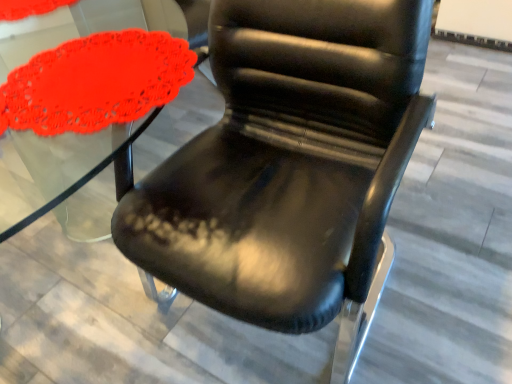
Describe the element at coordinates (290, 166) in the screenshot. The image size is (512, 384). I see `black leather chair at center` at that location.

Locate an element on the screen. black leather chair at center is located at coordinates (290, 166).

Image resolution: width=512 pixels, height=384 pixels. Describe the element at coordinates (83, 104) in the screenshot. I see `matte red doily at left` at that location.

The width and height of the screenshot is (512, 384). Identify the location of matte red doily at left. (83, 104).

The image size is (512, 384). What are the coordinates of `black leather chair at center` in the screenshot? It's located at (290, 166).

Is matte red doily at left at the left side of black leather chair at center?

Yes, matte red doily at left is to the left of black leather chair at center.

Considering the relative positions of matte red doily at left and black leather chair at center in the image provided, is matte red doily at left behind black leather chair at center?

Yes, matte red doily at left is further from the viewer.

Which is in front, point (75, 126) or point (375, 149)?

The point (75, 126) is in front.

From the image's perspective, which is below, matte red doily at left or black leather chair at center?

black leather chair at center appears lower in the image.

From a real-world perspective, is matte red doily at left over black leather chair at center?

Correct, in the physical world, matte red doily at left is higher than black leather chair at center.

Can you confirm if matte red doily at left is thinner than black leather chair at center?

Yes, matte red doily at left is thinner than black leather chair at center.

Is matte red doily at left taller or shorter than black leather chair at center?

matte red doily at left is shorter than black leather chair at center.

Looking at the image, does matte red doily at left seem bigger or smaller compared to black leather chair at center?

matte red doily at left is smaller than black leather chair at center.

Is matte red doily at left situated inside black leather chair at center or outside?

matte red doily at left is inside black leather chair at center.

Is matte red doily at left touching black leather chair at center?

No, matte red doily at left is not in contact with black leather chair at center.

Is matte red doily at left facing towards black leather chair at center?

Yes, matte red doily at left is oriented towards black leather chair at center.

The height and width of the screenshot is (384, 512). I want to click on chair in front of the matte red doily at left, so click(290, 166).

Is black leather chair at center at the left side of matte red doily at left?

Incorrect, black leather chair at center is not on the left side of matte red doily at left.

Is black leather chair at center positioned behind matte red doily at left?

No, black leather chair at center is in front of matte red doily at left.

Is point (422, 104) positioned after point (169, 74)?

Yes, point (422, 104) is farther from viewer.

From the image's perspective, which is below, black leather chair at center or matte red doily at left?

black leather chair at center is shown below in the image.

From a real-world perspective, is black leather chair at center positioned above or below matte red doily at left?

In terms of real-world spatial position, black leather chair at center is below matte red doily at left.

Is black leather chair at center thinner than matte red doily at left?

In fact, black leather chair at center might be wider than matte red doily at left.

Does black leather chair at center have a greater height compared to matte red doily at left?

Indeed, black leather chair at center has a greater height compared to matte red doily at left.

Can you confirm if black leather chair at center is smaller than matte red doily at left?

Incorrect, black leather chair at center is not smaller in size than matte red doily at left.

Can we say black leather chair at center lies outside matte red doily at left?

black leather chair at center is positioned outside matte red doily at left.

Is black leather chair at center next to matte red doily at left and touching it?

No, black leather chair at center is not in contact with matte red doily at left.

Is black leather chair at center oriented away from matte red doily at left?

That's not correct — black leather chair at center is not looking away from matte red doily at left.

How many degrees apart are the facing directions of black leather chair at center and matte red doily at left?

The angular difference between black leather chair at center and matte red doily at left is 180 degrees.

The height and width of the screenshot is (384, 512). I want to click on chair located underneath the matte red doily at left (from a real-world perspective), so click(290, 166).

Locate an element on the screen. This screenshot has height=384, width=512. chair that is under the matte red doily at left (from a real-world perspective) is located at coordinates (290, 166).

I want to click on chair in front of the matte red doily at left, so click(x=290, y=166).